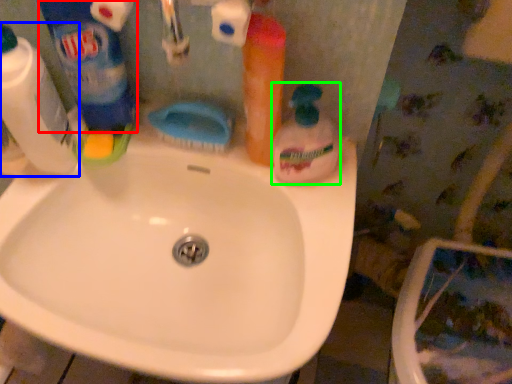
Question: Considering the real-world distances, which object is closest to cleaning product (highlighted by a red box)? cleaning product (highlighted by a blue box) or cleaning product (highlighted by a green box).

Choices:
 (A) cleaning product
 (B) cleaning product

Answer: (A)